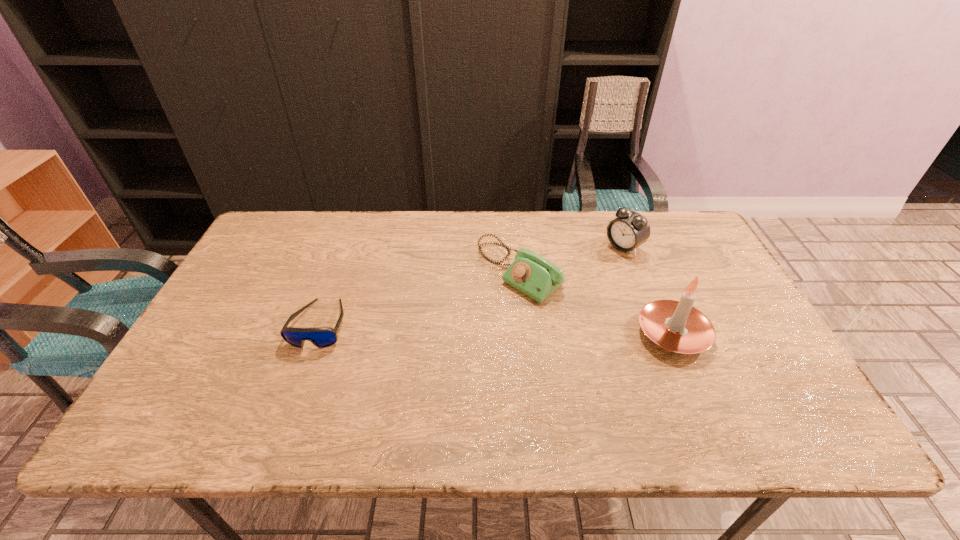
Identify the location of vacant area at the right edge of the desktop. The width and height of the screenshot is (960, 540). (725, 343).

Find the location of a particular element. This screenshot has width=960, height=540. vacant space at the near left corner of the desktop is located at coordinates (228, 382).

Locate an element on the screen. This screenshot has height=540, width=960. vacant space at the far right corner of the desktop is located at coordinates (660, 240).

What are the coordinates of `blank region between the shortest object and the tallest object` in the screenshot? It's located at tap(496, 329).

The height and width of the screenshot is (540, 960). Find the location of `vacant space that's between the alarm clock and the sunglasses`. vacant space that's between the alarm clock and the sunglasses is located at coordinates (472, 286).

Identify the location of free area in between the third shortest object and the shortest object. (472, 286).

Where is `free spot between the alarm clock and the candle`? The image size is (960, 540). free spot between the alarm clock and the candle is located at coordinates (648, 291).

I want to click on vacant region between the third object from right to left and the sunglasses, so click(x=420, y=298).

At what (x,y) coordinates should I click in order to perform the action: click on blank region between the third shortest object and the sunglasses. Please return your answer as a coordinate pair (x, y). The height and width of the screenshot is (540, 960). Looking at the image, I should click on (472, 286).

The width and height of the screenshot is (960, 540). Find the location of `free area in between the alarm clock and the tallest object`. free area in between the alarm clock and the tallest object is located at coordinates (648, 291).